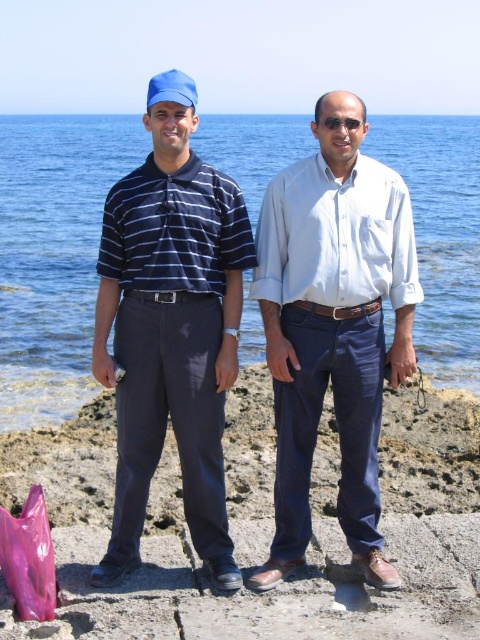
Is clear blue water at center to the left of white cotton shirt at center from the viewer's perspective?

Incorrect, clear blue water at center is not on the left side of white cotton shirt at center.

Is point (465, 227) positioned before point (373, 353)?

No, it is not.

Locate an element on the screen. Image resolution: width=480 pixels, height=640 pixels. clear blue water at center is located at coordinates (54, 253).

Measure the distance between point (368, 216) and camera.

Point (368, 216) is 6.15 meters away from camera.

The height and width of the screenshot is (640, 480). Find the location of `blue cotton shirt at center`. blue cotton shirt at center is located at coordinates (334, 326).

Find the location of a particular element. The height and width of the screenshot is (640, 480). blue cotton shirt at center is located at coordinates (334, 326).

Image resolution: width=480 pixels, height=640 pixels. What do you see at coordinates (334, 326) in the screenshot?
I see `blue cotton shirt at center` at bounding box center [334, 326].

Which is above, blue cotton shirt at center or white cotton shirt at center?

blue cotton shirt at center is higher up.

Between point (288, 269) and point (362, 372), which one is positioned in front?

Point (362, 372)

Where is `blue cotton shirt at center`? blue cotton shirt at center is located at coordinates (334, 326).